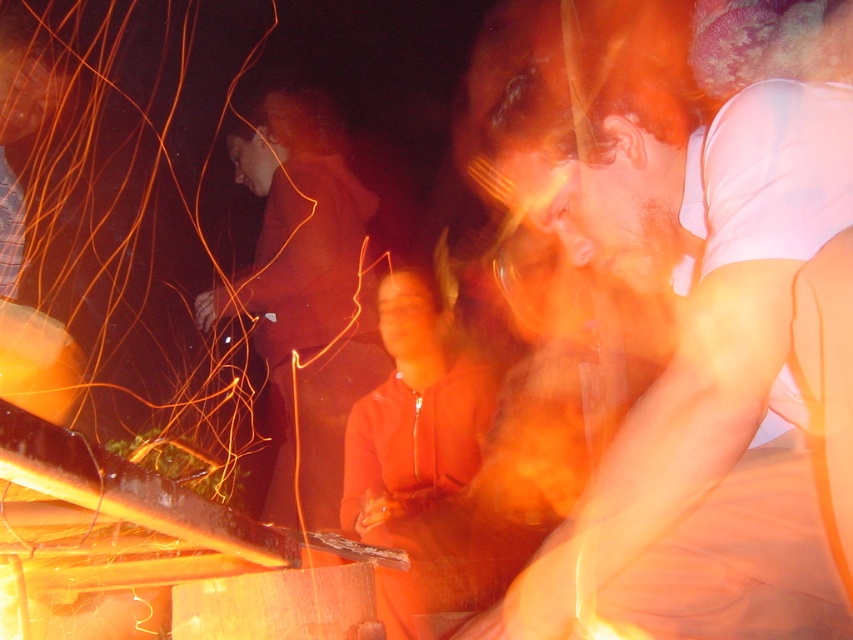
Is smooth white shirt at center smaller than matte orange jacket at center?

No.

Is point (695, 600) more distant than point (392, 332)?

That is False.

I want to click on smooth white shirt at center, so click(682, 314).

Does matte orange hoodie at center have a greater height compared to matte orange jacket at center?

Yes.

Is matte orange hoodie at center positioned before matte orange jacket at center?

No, it is behind matte orange jacket at center.

The image size is (853, 640). What do you see at coordinates (305, 294) in the screenshot?
I see `matte orange hoodie at center` at bounding box center [305, 294].

Find the location of a particular element. The width and height of the screenshot is (853, 640). matte orange hoodie at center is located at coordinates click(305, 294).

Between smooth white shirt at center and matte orange hoodie at center, which one is positioned higher?

smooth white shirt at center is higher up.

Between smooth white shirt at center and matte orange hoodie at center, which one appears on the left side from the viewer's perspective?

matte orange hoodie at center

I want to click on smooth white shirt at center, so click(x=682, y=314).

I want to click on smooth white shirt at center, so click(x=682, y=314).